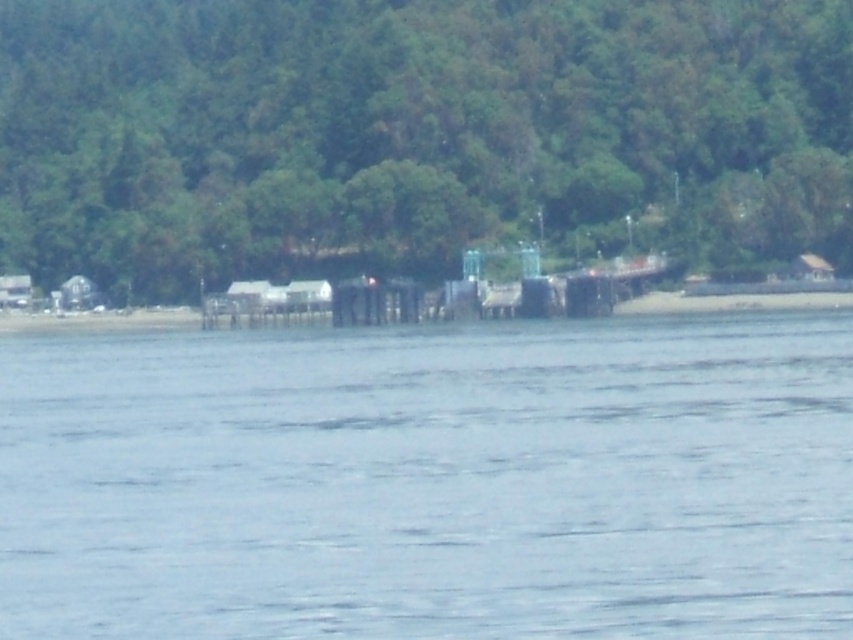
Looking at this image, does clear water at center appear under green leafy tree at center?

Yes.

Between point (392, 420) and point (497, 99), which one is positioned behind?

Point (497, 99)

In order to click on clear water at center in this screenshot , I will do `click(431, 481)`.

Where is `clear water at center`? Image resolution: width=853 pixels, height=640 pixels. clear water at center is located at coordinates (431, 481).

Is green leafy tree at center to the left of wooden pier at center from the viewer's perspective?

Correct, you'll find green leafy tree at center to the left of wooden pier at center.

Can you confirm if green leafy tree at center is shorter than wooden pier at center?

Incorrect, green leafy tree at center's height does not fall short of wooden pier at center's.

Is point (332, 237) behind point (389, 291)?

Yes, it is behind point (389, 291).

At what (x,y) coordinates should I click in order to perform the action: click on green leafy tree at center. Please return your answer as a coordinate pair (x, y). The image size is (853, 640). Looking at the image, I should click on (416, 134).

Which is more to the left, clear water at center or wooden pier at center?

From the viewer's perspective, clear water at center appears more on the left side.

Does clear water at center appear on the right side of wooden pier at center?

No, clear water at center is not to the right of wooden pier at center.

Identify the location of clear water at center. Image resolution: width=853 pixels, height=640 pixels. (431, 481).